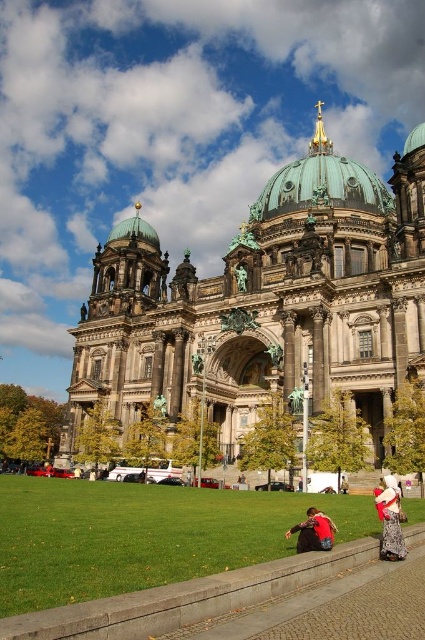
Question: Is green grass at lower center smaller than patterned fabric dress at lower right?

Choices:
 (A) no
 (B) yes

Answer: (A)

Question: Which of the following is the closest to the observer?

Choices:
 (A) (x=314, y=536)
 (B) (x=217, y=323)
 (C) (x=357, y=179)
 (D) (x=393, y=552)

Answer: (A)

Question: Where is dark gray stone church at center located in relation to red fabric jacket at lower center in the image?

Choices:
 (A) below
 (B) above

Answer: (B)

Question: Which point is closer to the camera?

Choices:
 (A) (255, 202)
 (B) (320, 541)
 (C) (61, 499)
 (D) (308, 349)

Answer: (B)

Question: Estimate the real-world distances between objects in this image. Which object is farther from the green copper dome at upper center?

Choices:
 (A) dark gray stone church at center
 (B) green grass at lower center

Answer: (B)

Question: Is dark gray stone church at center to the right of green copper dome at upper center from the viewer's perspective?

Choices:
 (A) yes
 (B) no

Answer: (B)